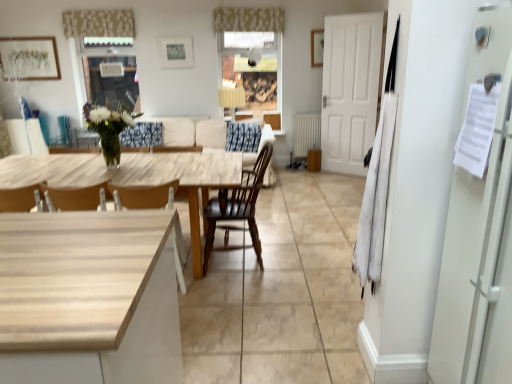
Locate an element on the screen. metallic silver picture frame at upper center, positioned as the 2th picture frame in right-to-left order is located at coordinates (176, 52).

Image resolution: width=512 pixels, height=384 pixels. What do you see at coordinates (237, 208) in the screenshot?
I see `dark brown wood chair at center, positioned as the second chair in left-to-right order` at bounding box center [237, 208].

The width and height of the screenshot is (512, 384). What do you see at coordinates (98, 23) in the screenshot?
I see `beige textured curtain at upper center, placed as the second curtain when sorted from right to left` at bounding box center [98, 23].

Locate an element on the screen. This screenshot has width=512, height=384. matte silver picture frame at upper left, the 1th picture frame positioned from the left is located at coordinates (29, 58).

Image resolution: width=512 pixels, height=384 pixels. Describe the element at coordinates (317, 47) in the screenshot. I see `matte wooden picture frame at upper center, the first picture frame positioned from the right` at that location.

Measure the distance between beige fabric couch at center and camera.

A distance of 5.98 meters exists between beige fabric couch at center and camera.

Find the location of a particular element. metallic silver picture frame at upper center, which is counted as the 2th picture frame, starting from the left is located at coordinates pos(176,52).

Is wooden chair at center, the 1th chair viewed from the left, placed right next to matte wood cabinet at center?

wooden chair at center, the 1th chair viewed from the left, and matte wood cabinet at center are clearly separated.

Identify the location of cabinetry behind the wooden chair at center, the 1th chair viewed from the left. This screenshot has height=384, width=512. (273, 119).

Can you confirm if wooden chair at center, the second chair from the right, is thinner than matte wood cabinet at center?

No.

Is metallic silver picture frame at upper center, positioned as the 2th picture frame in right-to-left order, a part of beige floral fabric valance at upper center, positioned as the 2th curtain in left-to-right order?

Definitely not — metallic silver picture frame at upper center, positioned as the 2th picture frame in right-to-left order, is not inside beige floral fabric valance at upper center, positioned as the 2th curtain in left-to-right order.

Considering the sizes of objects beige floral fabric valance at upper center, positioned as the 2th curtain in left-to-right order, and metallic silver picture frame at upper center, positioned as the 2th picture frame in right-to-left order, in the image provided, who is thinner, beige floral fabric valance at upper center, positioned as the 2th curtain in left-to-right order, or metallic silver picture frame at upper center, positioned as the 2th picture frame in right-to-left order,?

Thinner between the two is metallic silver picture frame at upper center, positioned as the 2th picture frame in right-to-left order.

Which object is positioned more to the left, beige floral fabric valance at upper center, positioned as the 2th curtain in left-to-right order, or metallic silver picture frame at upper center, positioned as the 2th picture frame in right-to-left order?

metallic silver picture frame at upper center, positioned as the 2th picture frame in right-to-left order.

Measure the distance from beige floral fabric valance at upper center, which appears as the first curtain when viewed from the right, to metallic silver picture frame at upper center, positioned as the 2th picture frame in right-to-left order.

A distance of 83.08 centimeters exists between beige floral fabric valance at upper center, which appears as the first curtain when viewed from the right, and metallic silver picture frame at upper center, positioned as the 2th picture frame in right-to-left order.

From a real-world perspective, is metallic silver picture frame at upper center, positioned as the 2th picture frame in right-to-left order, above or below beige fabric couch at center?

In terms of real-world spatial position, metallic silver picture frame at upper center, positioned as the 2th picture frame in right-to-left order, is above beige fabric couch at center.

From the image's perspective, would you say metallic silver picture frame at upper center, which is counted as the 2th picture frame, starting from the left, is positioned over beige fabric couch at center?

Indeed, from the image's perspective, metallic silver picture frame at upper center, which is counted as the 2th picture frame, starting from the left, is shown above beige fabric couch at center.

Considering the relative positions of metallic silver picture frame at upper center, which is counted as the 2th picture frame, starting from the left, and beige fabric couch at center in the image provided, is metallic silver picture frame at upper center, which is counted as the 2th picture frame, starting from the left, to the left or to the right of beige fabric couch at center?

Based on their positions, metallic silver picture frame at upper center, which is counted as the 2th picture frame, starting from the left, is located to the left of beige fabric couch at center.

Is beige fabric couch at center surrounded by metallic silver picture frame at upper center, which is counted as the 2th picture frame, starting from the left?

That's incorrect, beige fabric couch at center is not inside metallic silver picture frame at upper center, which is counted as the 2th picture frame, starting from the left.

Is dark brown wood chair at center, positioned as the second chair in left-to-right order, oriented away from matte silver picture frame at upper left, the 3th picture frame in the right-to-left sequence?

No, dark brown wood chair at center, positioned as the second chair in left-to-right order, is not facing the opposite direction of matte silver picture frame at upper left, the 3th picture frame in the right-to-left sequence.

From the image's perspective, which is above, dark brown wood chair at center, positioned as the second chair in left-to-right order, or matte silver picture frame at upper left, the 3th picture frame in the right-to-left sequence?

matte silver picture frame at upper left, the 3th picture frame in the right-to-left sequence, appears higher in the image.

From a real-world perspective, is dark brown wood chair at center, positioned as the second chair in left-to-right order, under matte silver picture frame at upper left, the 3th picture frame in the right-to-left sequence?

Yes, from a real-world perspective, dark brown wood chair at center, positioned as the second chair in left-to-right order, is under matte silver picture frame at upper left, the 3th picture frame in the right-to-left sequence.

Which is behind, dark brown wood chair at center, which is counted as the first chair, starting from the right, or matte silver picture frame at upper left, the 1th picture frame positioned from the left?

matte silver picture frame at upper left, the 1th picture frame positioned from the left, is further away from the camera.

Looking at the image, does beige fabric couch at center seem bigger or smaller compared to matte wooden picture frame at upper center, the first picture frame positioned from the right?

Considering their sizes, beige fabric couch at center takes up more space than matte wooden picture frame at upper center, the first picture frame positioned from the right.

Which is in front, point (187, 120) or point (319, 31)?

The point (319, 31) is closer.

Which object is further away from the camera, beige fabric couch at center or matte wooden picture frame at upper center, which is counted as the third picture frame, starting from the left?

matte wooden picture frame at upper center, which is counted as the third picture frame, starting from the left, is more distant.

Is matte wooden picture frame at upper center, which is counted as the third picture frame, starting from the left, inside beige fabric couch at center?

Definitely not — matte wooden picture frame at upper center, which is counted as the third picture frame, starting from the left, is not inside beige fabric couch at center.

From a real-world perspective, is light wood table at center on wooden chair at center, the 1th chair viewed from the left?

No.

Is light wood table at center not near wooden chair at center, the 1th chair viewed from the left?

No, light wood table at center is not far from wooden chair at center, the 1th chair viewed from the left.

Is light wood table at center oriented towards wooden chair at center, the second chair from the right?

Yes, light wood table at center is facing wooden chair at center, the second chair from the right.

Can you confirm if light wood table at center is thinner than wooden chair at center, the 1th chair viewed from the left?

In fact, light wood table at center might be wider than wooden chair at center, the 1th chair viewed from the left.

Is matte wood cabinet at center a part of metallic silver picture frame at upper center, which is counted as the 2th picture frame, starting from the left?

No.

Visually, is metallic silver picture frame at upper center, positioned as the 2th picture frame in right-to-left order, positioned to the left or to the right of matte wood cabinet at center?

From the image, it's evident that metallic silver picture frame at upper center, positioned as the 2th picture frame in right-to-left order, is to the left of matte wood cabinet at center.

How distant is metallic silver picture frame at upper center, which is counted as the 2th picture frame, starting from the left, from matte wood cabinet at center?

The distance of metallic silver picture frame at upper center, which is counted as the 2th picture frame, starting from the left, from matte wood cabinet at center is 1.63 meters.

Locate an element on the screen. the 2nd picture frame in front when counting from the matte wood cabinet at center is located at coordinates (176, 52).

I want to click on the 2nd chair to the left of the matte wood cabinet at center, starting your count from the anchor, so click(x=144, y=196).

Identify the location of the 2nd picture frame behind the beige floral fabric valance at upper center, positioned as the 2th curtain in left-to-right order, counting from the anchor's position. (176, 52).

Considering their positions, is matte wood cabinet at center positioned further to beige fabric couch at center than matte wooden picture frame at upper center, which is counted as the third picture frame, starting from the left?

Based on the image, matte wooden picture frame at upper center, which is counted as the third picture frame, starting from the left, appears to be further to beige fabric couch at center.

From the picture: Based on their spatial positions, is matte silver picture frame at upper left, the 3th picture frame in the right-to-left sequence, or matte wooden picture frame at upper center, which is counted as the third picture frame, starting from the left, closer to beige floral fabric valance at upper center, which appears as the first curtain when viewed from the right?

matte wooden picture frame at upper center, which is counted as the third picture frame, starting from the left, is positioned closer to the anchor beige floral fabric valance at upper center, which appears as the first curtain when viewed from the right.

Which object lies nearer to the anchor point dark brown wood chair at center, which is counted as the first chair, starting from the right, matte silver picture frame at upper left, the 1th picture frame positioned from the left, or matte wood cabinet at center?

Among the two, matte wood cabinet at center is located nearer to dark brown wood chair at center, which is counted as the first chair, starting from the right.

Which object lies nearer to the anchor point metallic silver picture frame at upper center, positioned as the 2th picture frame in right-to-left order, matte silver picture frame at upper left, the 1th picture frame positioned from the left, or dark brown wood chair at center, which is counted as the first chair, starting from the right?

matte silver picture frame at upper left, the 1th picture frame positioned from the left, is closer to metallic silver picture frame at upper center, positioned as the 2th picture frame in right-to-left order.

Which object lies further to the anchor point matte wooden picture frame at upper center, the first picture frame positioned from the right, beige floral fabric valance at upper center, positioned as the 2th curtain in left-to-right order, or matte wood cabinet at center?

matte wood cabinet at center is positioned further to the anchor matte wooden picture frame at upper center, the first picture frame positioned from the right.

Considering their positions, is matte wooden picture frame at upper center, the first picture frame positioned from the right, positioned further to beige textured curtain at upper center, placed as the second curtain when sorted from right to left, than metallic silver picture frame at upper center, which is counted as the 2th picture frame, starting from the left?

The object further to beige textured curtain at upper center, placed as the second curtain when sorted from right to left, is matte wooden picture frame at upper center, the first picture frame positioned from the right.

From the image, which object appears to be nearer to matte silver picture frame at upper left, the 3th picture frame in the right-to-left sequence, metallic silver picture frame at upper center, which is counted as the 2th picture frame, starting from the left, or matte wood cabinet at center?

The object closer to matte silver picture frame at upper left, the 3th picture frame in the right-to-left sequence, is metallic silver picture frame at upper center, which is counted as the 2th picture frame, starting from the left.

Which object lies further to the anchor point wooden chair at center, the second chair from the right, dark brown wood chair at center, which is counted as the first chair, starting from the right, or beige textured curtain at upper center, which is the 1th curtain from left to right?

beige textured curtain at upper center, which is the 1th curtain from left to right.

The height and width of the screenshot is (384, 512). What are the coordinates of `curtain located between beige textured curtain at upper center, which is the 1th curtain from left to right, and matte wooden picture frame at upper center, which is counted as the third picture frame, starting from the left, in the left-right direction` in the screenshot? It's located at (248, 19).

Identify the location of couch between wooden chair at center, the second chair from the right, and matte silver picture frame at upper left, the 3th picture frame in the right-to-left sequence, in the front-back direction. The height and width of the screenshot is (384, 512). (194, 133).

At what (x,y) coordinates should I click in order to perform the action: click on curtain located between wooden chair at center, the 1th chair viewed from the left, and beige floral fabric valance at upper center, which appears as the first curtain when viewed from the right, in the depth direction. Please return your answer as a coordinate pair (x, y). Looking at the image, I should click on (98, 23).

This screenshot has width=512, height=384. I want to click on chair between light wood table at center and matte wood cabinet at center in the front-back direction, so click(237, 208).